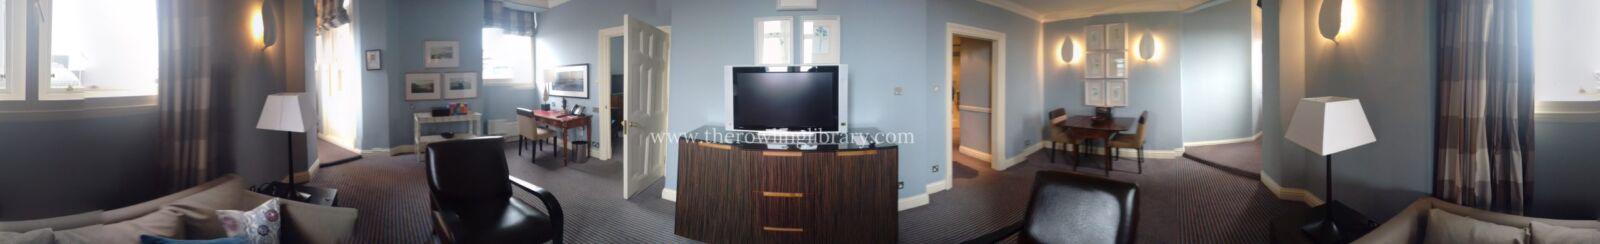
This screenshot has width=1600, height=244. In order to click on striped drapes in this screenshot , I will do `click(189, 62)`, `click(1477, 92)`.